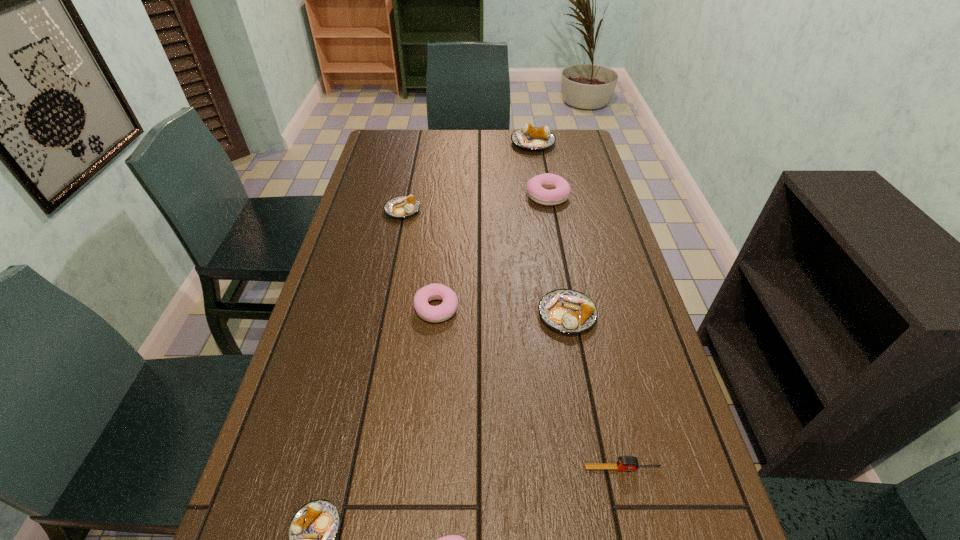
This screenshot has height=540, width=960. In order to click on the closest brown pastry to the second farthest brown pastry in this screenshot , I will do `click(531, 138)`.

This screenshot has width=960, height=540. What are the coordinates of `the closest brown pastry to the second biggest pink pastry` in the screenshot? It's located at (568, 311).

Image resolution: width=960 pixels, height=540 pixels. What are the coordinates of `the closest pink pastry to the nearest brown pastry` in the screenshot? It's located at (450, 539).

Where is `pink pastry that stands as the closest to the second nearest brown pastry`? pink pastry that stands as the closest to the second nearest brown pastry is located at coordinates (444, 311).

Find the location of a particular element. vacant space that satisfies the following two spatial constraints: 1. on the front side of the farthest pink pastry; 2. on the right side of the third nearest object is located at coordinates (598, 468).

Where is `vacant space that satisfies the following two spatial constraints: 1. on the front side of the sixth farthest object; 2. on the right side of the farthest pink pastry`? The image size is (960, 540). vacant space that satisfies the following two spatial constraints: 1. on the front side of the sixth farthest object; 2. on the right side of the farthest pink pastry is located at coordinates (598, 468).